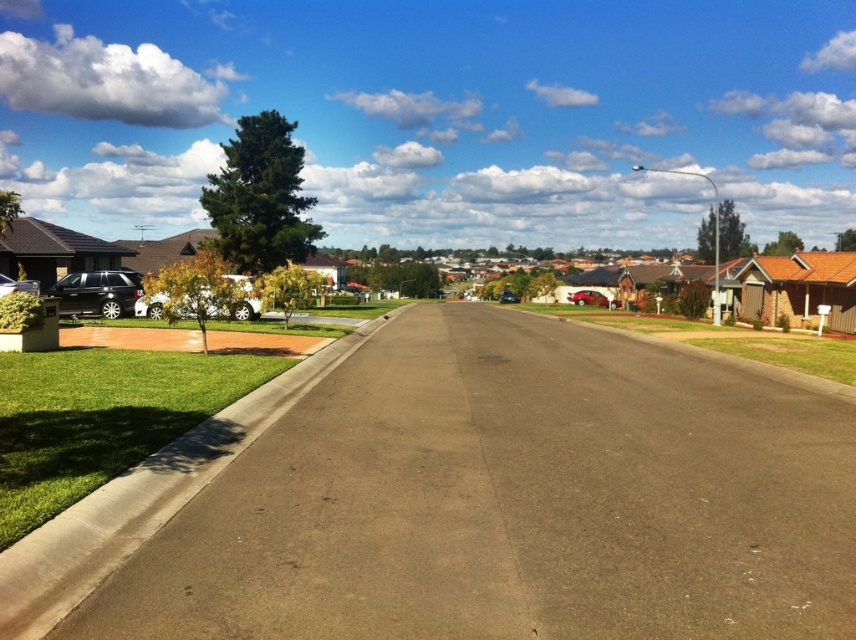
Consider the image. You are standing at the point with coordinates point (504,292) and want to walk to the point with coordinates point (22,285). According to the scene, which direction should you face to move towards your destination?

You should face forward because point (22,285) is in front of point (504,292).